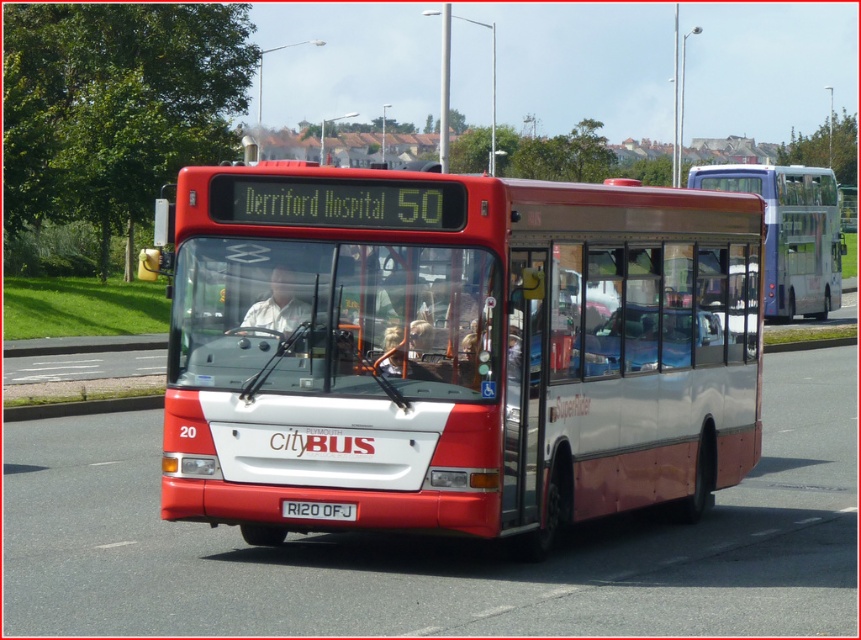
You are a passenger on the bus and you notice two items at the center of the bus. One is a matte white shirt at center and the other is a white plastic license plate at center. Which of these two items is narrower?

The matte white shirt at center has a lesser width compared to the white plastic license plate at center, so the matte white shirt at center is narrower.

You are a city planner analyzing bus sizes for a new parking lot. You observe a matte red bus at center and a metallic silver bus at center in the image. Which bus requires a wider parking space based on their sizes?

The metallic silver bus at center requires a wider parking space because its width is greater than the matte red bus at center.